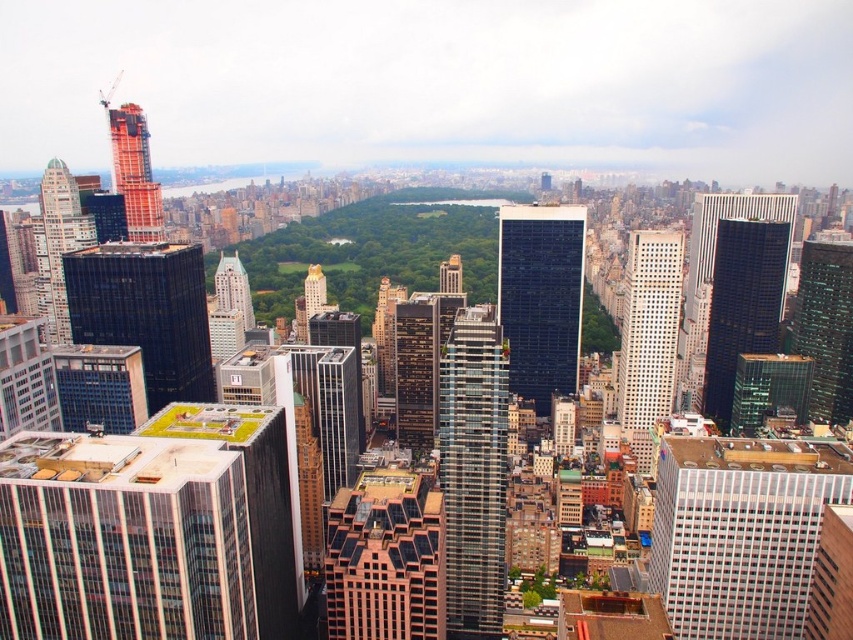
Can you confirm if glassy reflective skyscraper at left is positioned to the right of brown brick building at center?

Incorrect, glassy reflective skyscraper at left is not on the right side of brown brick building at center.

Is glassy reflective skyscraper at left to the left of brown brick building at center from the viewer's perspective?

Correct, you'll find glassy reflective skyscraper at left to the left of brown brick building at center.

I want to click on glassy reflective skyscraper at left, so click(x=123, y=540).

Is glassy black skyscraper at right to the right of glassy white skyscraper at center from the viewer's perspective?

Indeed, glassy black skyscraper at right is positioned on the right side of glassy white skyscraper at center.

Does glassy black skyscraper at right lie behind glassy white skyscraper at center?

Yes, it is behind glassy white skyscraper at center.

The image size is (853, 640). Identify the location of glassy black skyscraper at right. (741, 305).

Between glassy steel skyscraper at center and glassy white skyscraper at center, which one is positioned higher?

glassy white skyscraper at center is above.

Who is lower down, glassy steel skyscraper at center or glassy white skyscraper at center?

glassy steel skyscraper at center is lower down.

The image size is (853, 640). I want to click on glassy steel skyscraper at center, so click(473, 470).